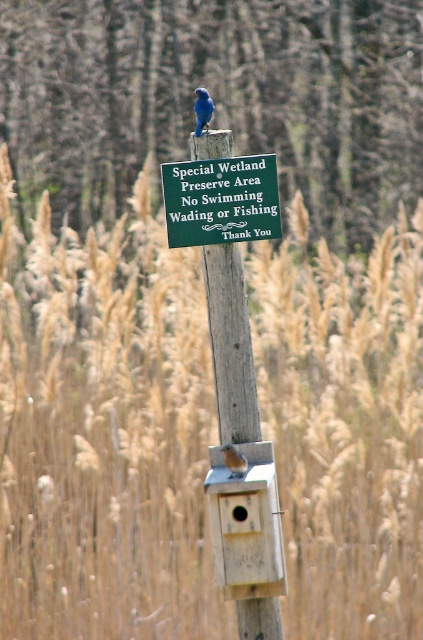
You are a photographer aiming to capture a clear photo of the green wood sign at center and the blue matte bird at upper center. Which object will appear larger in your photo?

The green wood sign at center will appear larger in the photo because it is closer to the viewer than the blue matte bird at upper center.

What is located at the point with coordinates (203, 109) in the image?

The point at coordinates (203, 109) marks the location of a blue matte bird at upper center.